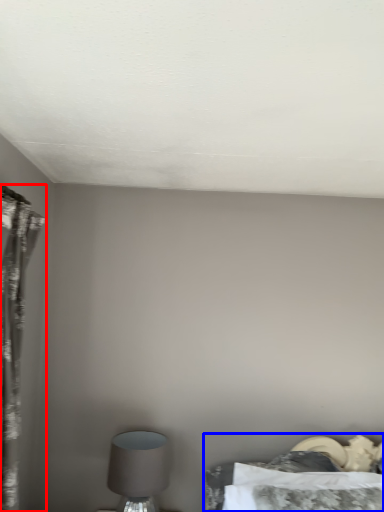
Question: Which object is closer to the camera taking this photo, curtain (highlighted by a red box) or bed (highlighted by a blue box)?

Choices:
 (A) curtain
 (B) bed

Answer: (A)